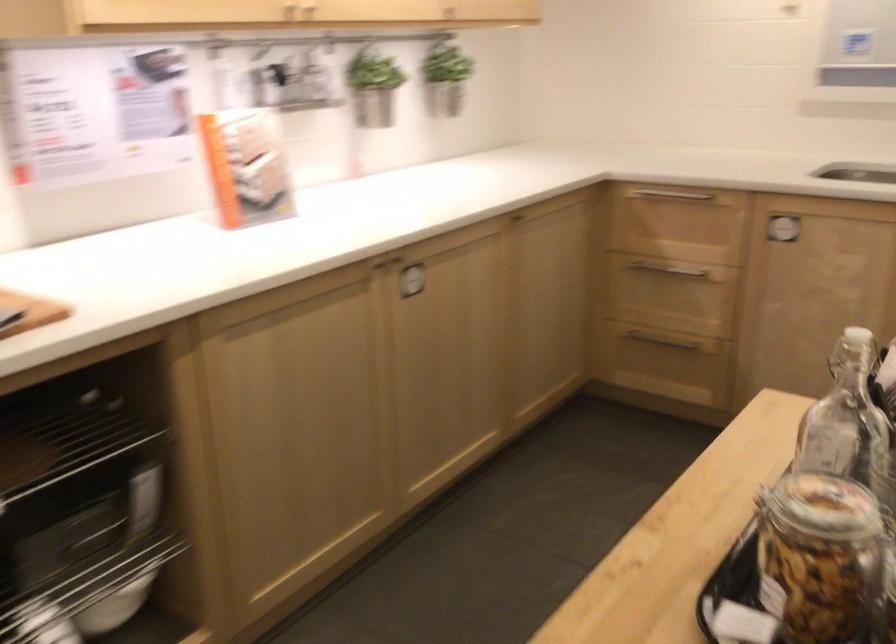
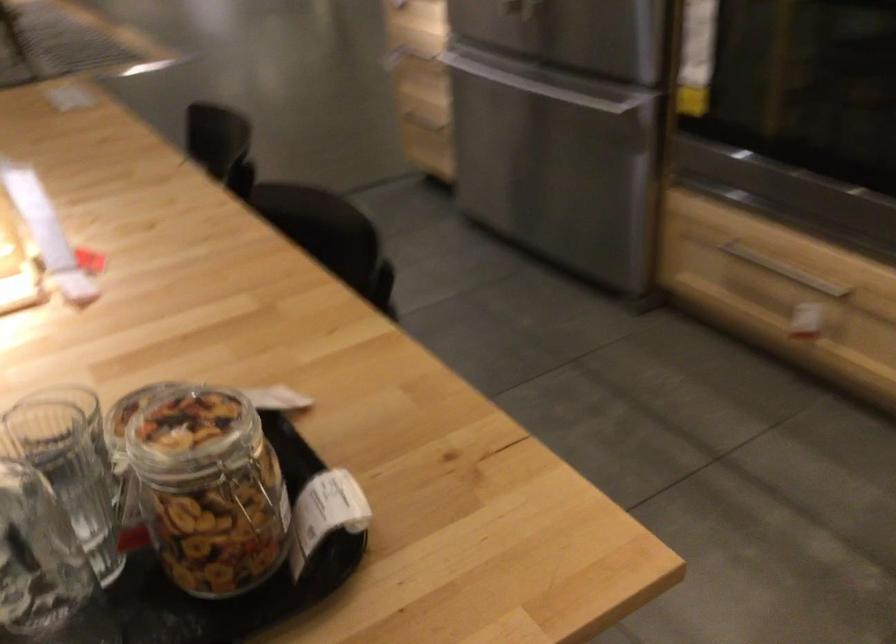
Where in the second image is the point corresponding to point (650, 564) from the first image?

(250, 493)